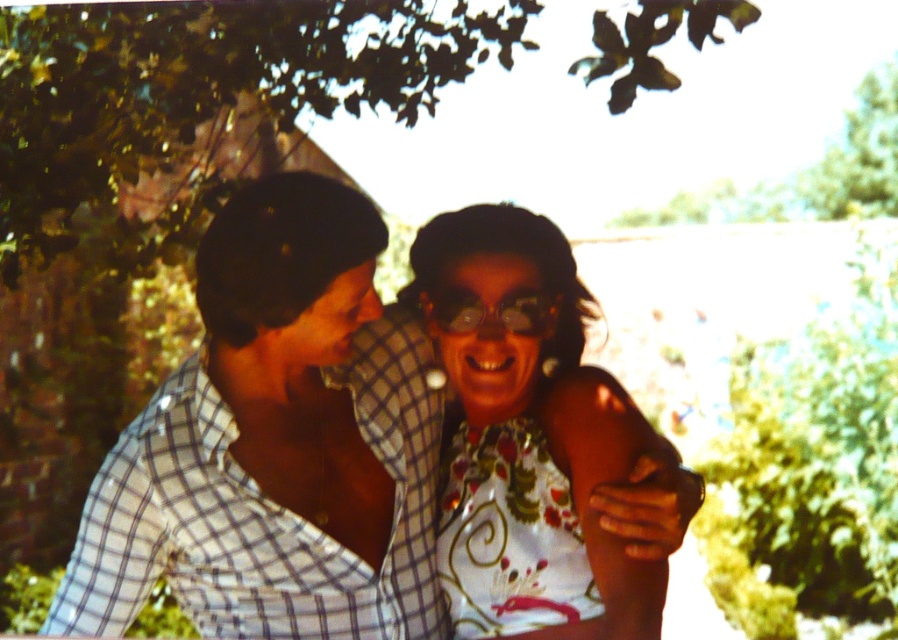
You are planning to take a photo of the checkered fabric shirt at left and the green leafy tree at upper center. Since the tree is wider than the shirt, will the tree block the view of the shirt in the photo if you frame them both?

The green leafy tree at upper center is wider than the checkered fabric shirt at left. However, since the tree is at upper center and the shirt is at left, their positions might not overlap entirely. To ensure the shirt is visible, position the camera so the tree is above and centered while the shirt remains on the left edge, avoiding overlap.

You are standing in a park and want to find the green leafy tree at upper center. Based on its coordinates, where should you look?

The green leafy tree at upper center is located at point (x=197, y=102), so you should look towards the upper center area of the image.

You are standing at the camera position and want to take a photo of the two people in the scene. The focus point of your camera is set to point at the coordinates point (x=147, y=456). Since the focus point is 5.44 feet away from the camera, will the two people be in focus if the depth of field can cover up to 6 feet?

The focus point at point (x=147, y=456) is 5.44 feet from the camera. Since the depth of field covers up to 6 feet, the two people will be in focus as they are within the depth of field range.